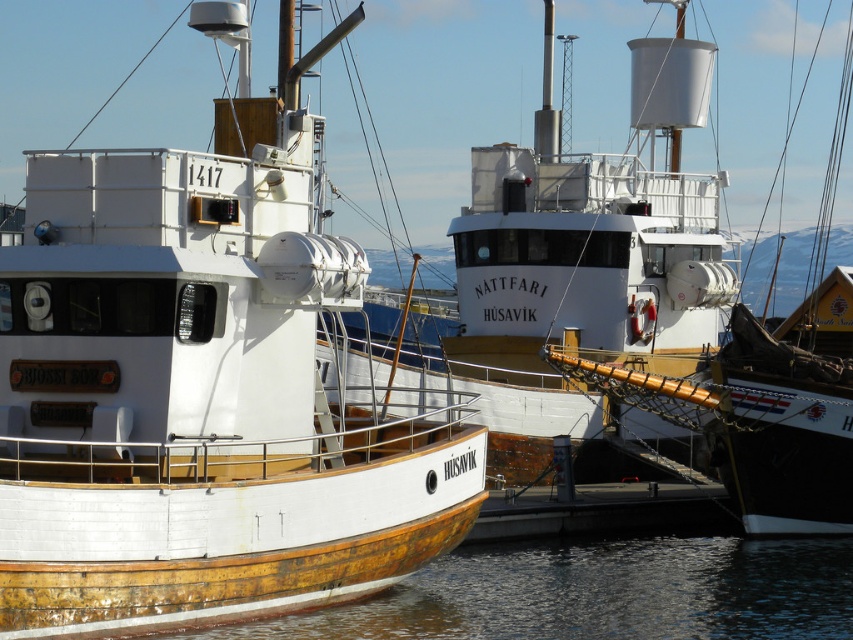
Question: Can you confirm if white matte boat at center is bigger than wooden water at lower left?

Choices:
 (A) yes
 (B) no

Answer: (A)

Question: Which point appears closest to the camera in this image?

Choices:
 (A) (819, 333)
 (B) (618, 337)
 (C) (312, 550)
 (D) (554, 614)

Answer: (C)

Question: Which point appears farthest from the camera in this image?

Choices:
 (A) (543, 60)
 (B) (547, 632)
 (C) (15, 481)
 (D) (833, 179)

Answer: (D)

Question: Is wooden hull boat at center bigger than white matte boat at center?

Choices:
 (A) yes
 (B) no

Answer: (B)

Question: Is wooden hull boat at center below white matte boat at center?

Choices:
 (A) no
 (B) yes

Answer: (B)

Question: Among these objects, which one is nearest to the camera?

Choices:
 (A) wooden ship at center
 (B) wooden hull boat at center
 (C) wooden water at lower left

Answer: (B)